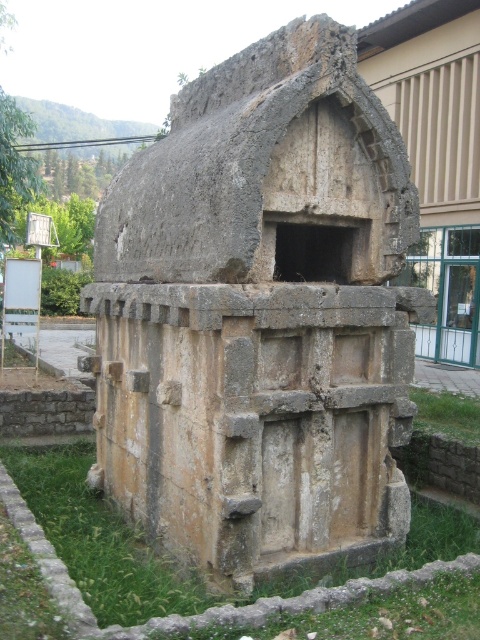
You are a gardener who wants to plant a new flower bed near the weathered stone tomb at center and the green grass at lower right. Considering their heights, which object should you place the flower bed closer to for better visibility?

The flower bed should be placed closer to the green grass at lower right because the weathered stone tomb at center is taller than the green grass at lower right, so the tomb will already block some of the view. Placing the flower bed near the shorter grass ensures it remains visible.